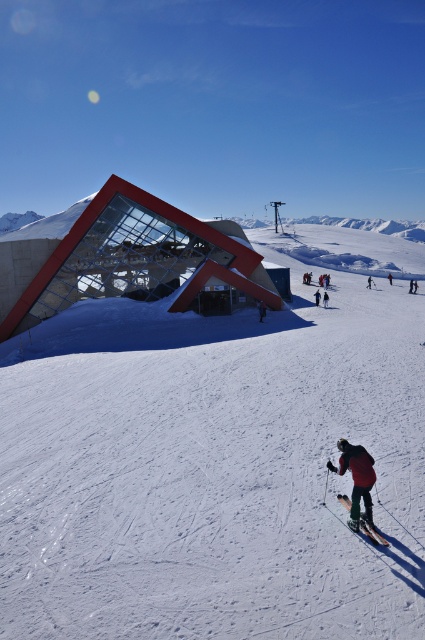
Question: Is shiny metallic skis at lower center further to the viewer compared to red ski suit at center?

Choices:
 (A) yes
 (B) no

Answer: (B)

Question: Based on their relative distances, which object is farther from the black fabric jacket at lower center?

Choices:
 (A) dark blue ski pants at center
 (B) white smooth snow at center
 (C) black matte snowboarder at lower right
 (D) shiny metallic skis at lower center

Answer: (D)

Question: Which point is closer to the camera?

Choices:
 (A) (260, 310)
 (B) (391, 280)
 (C) (346, 502)

Answer: (C)

Question: Does transparent glass building at center appear under red ski suit at center?

Choices:
 (A) no
 (B) yes

Answer: (B)

Question: Estimate the real-world distances between objects in this image. Which object is closer to the black matte snowboarder at lower right?

Choices:
 (A) dark blue ski jacket at center
 (B) black fabric jacket at lower center
 (C) red ski suit at center

Answer: (C)

Question: Can you confirm if transparent glass building at center is positioned below black fabric jacket at lower center?

Choices:
 (A) yes
 (B) no

Answer: (B)